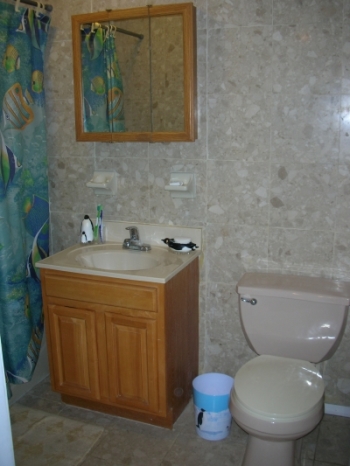
The image size is (350, 466). What are the coordinates of `faucet handle` in the screenshot? It's located at (128, 228).